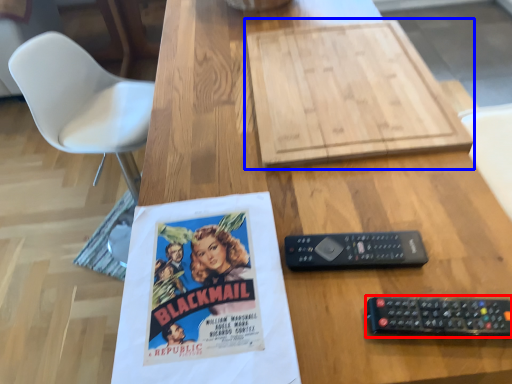
Question: Which object is further to the camera taking this photo, remote control (highlighted by a red box) or cardboard (highlighted by a blue box)?

Choices:
 (A) remote control
 (B) cardboard

Answer: (B)